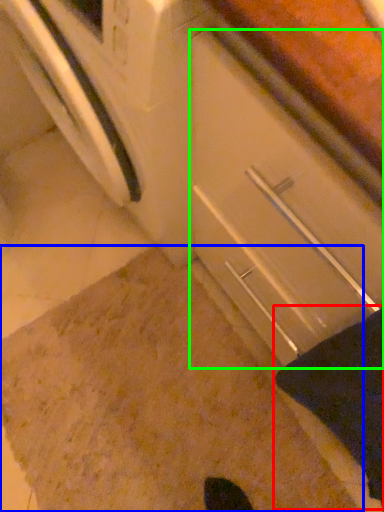
Question: Which is nearer to the blanket (highlighted by a red box)? granite (highlighted by a blue box) or drawer (highlighted by a green box).

Choices:
 (A) granite
 (B) drawer

Answer: (B)